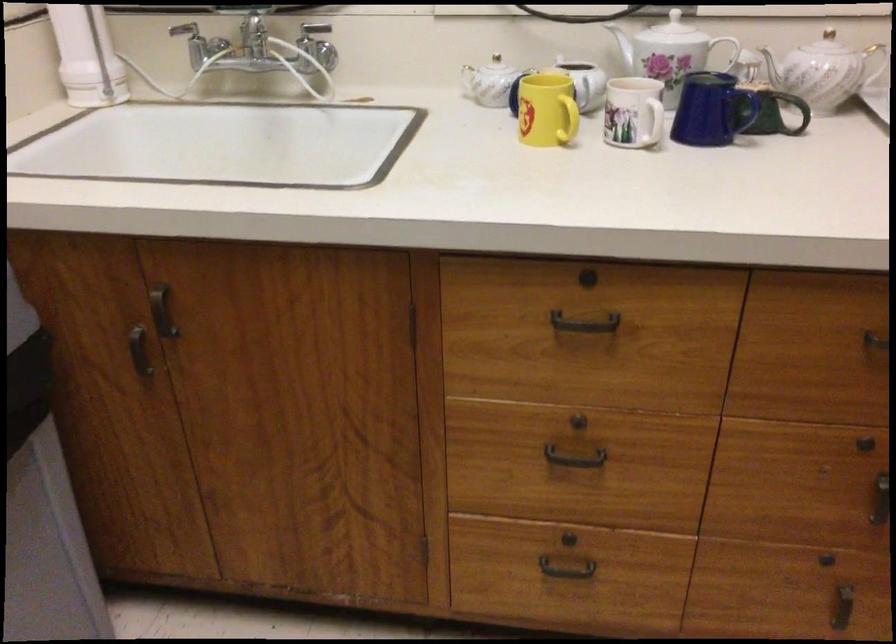
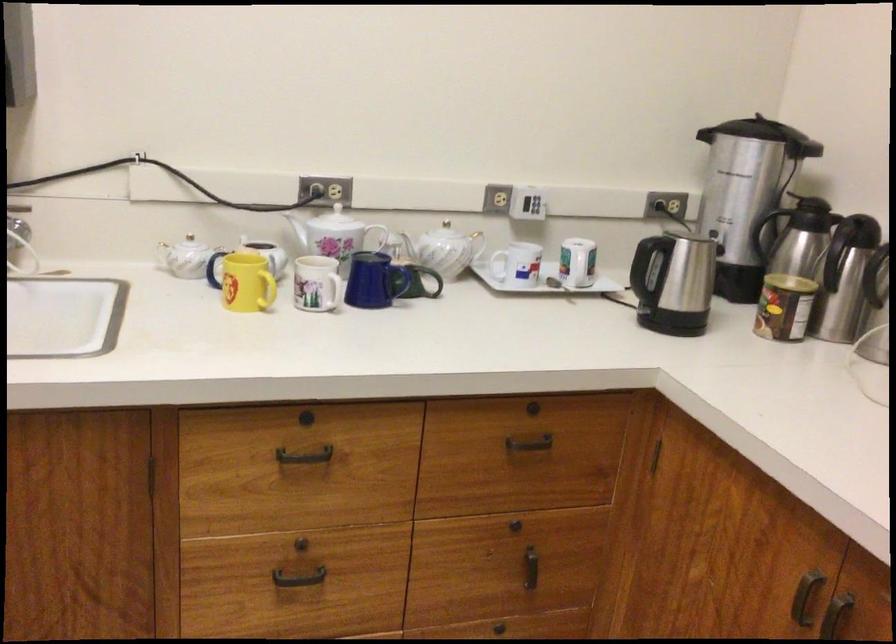
Question: How did the camera likely rotate?

Choices:
 (A) Left
 (B) Right
 (C) Up
 (D) Down

Answer: (B)